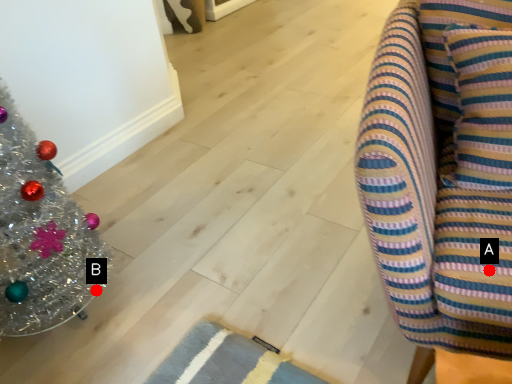
Question: Two points are circled on the image, labeled by A and B beside each circle. Which of the following is the closest to the observer?

Choices:
 (A) A is closer
 (B) B is closer

Answer: (A)